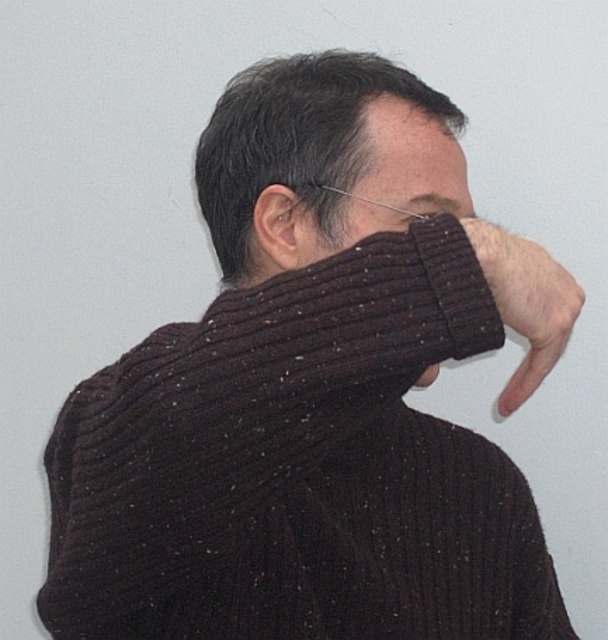
Question: Is bare skin at center positioned behind matte brown hair at upper center?

Choices:
 (A) no
 (B) yes

Answer: (A)

Question: Can you confirm if bare skin at center is bigger than matte skin ear at center?

Choices:
 (A) no
 (B) yes

Answer: (B)

Question: Which object appears farthest from the camera in this image?

Choices:
 (A) matte black nose at center
 (B) matte brown hair at upper center

Answer: (B)

Question: Can you confirm if matte black face at center is wider than bare skin at center?

Choices:
 (A) yes
 (B) no

Answer: (A)

Question: Which object is positioned farthest from the matte black nose at center?

Choices:
 (A) matte skin ear at center
 (B) dark ribbed sweater at center
 (C) matte black face at center

Answer: (B)

Question: Which of the following is the closest to the observer?

Choices:
 (A) (367, 104)
 (B) (291, 225)

Answer: (A)